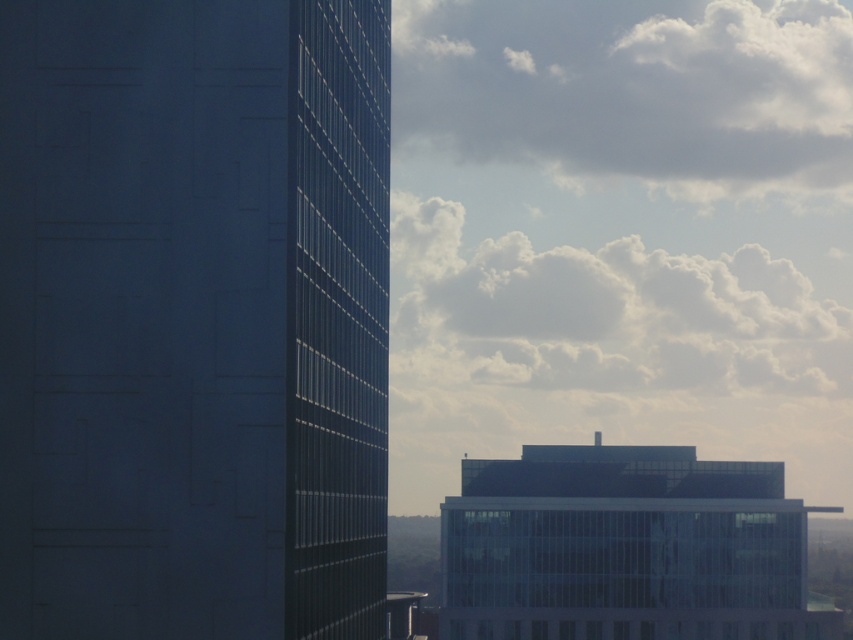
Does dark glass building at left have a larger size compared to transparent glass building at center?

Actually, dark glass building at left might be smaller than transparent glass building at center.

Between point (305, 460) and point (757, 472), which one is positioned behind?

The point (757, 472) is behind.

Where is `dark glass building at left`? The width and height of the screenshot is (853, 640). dark glass building at left is located at coordinates (193, 317).

The height and width of the screenshot is (640, 853). In order to click on dark glass building at left in this screenshot , I will do `click(193, 317)`.

Is point (86, 176) closer to viewer compared to point (693, 291)?

Yes.

Between dark glass building at left and white fluffy cloud at upper center, which one has more height?

white fluffy cloud at upper center is taller.

Is point (50, 278) positioned in front of point (463, 301)?

Yes.

What are the coordinates of `dark glass building at left` in the screenshot? It's located at (193, 317).

Is white fluffy cloud at upper right positioned behind transparent glass building at center?

Yes, it is behind transparent glass building at center.

From the picture: Which of these two, white fluffy cloud at upper right or transparent glass building at center, stands taller?

Standing taller between the two is white fluffy cloud at upper right.

The height and width of the screenshot is (640, 853). I want to click on white fluffy cloud at upper right, so click(634, 90).